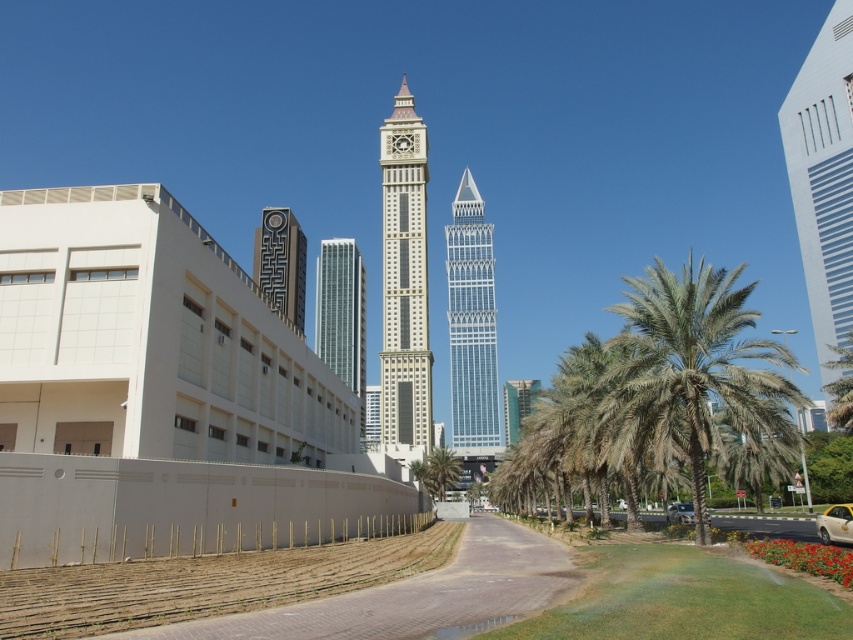
You are a city planner assessing the urban layout. You need to determine if the transparent glass tower at center and the green leafy palm tree at center are within the recommended 100 meters safety distance for emergency vehicle access. Can they be placed this close together?

The transparent glass tower at center and the green leafy palm tree at center are 82.11 meters apart, which is within the recommended 100 meters safety distance for emergency vehicle access. They can be placed this close together.

You are standing at point (676,502) and want to walk to the large modern building on the left. Is point (274,262) between you and the building?

Point (274,262) is behind point (676,502), so it is not between you and the large modern building on the left. You can walk towards the building without passing through point (274,262).